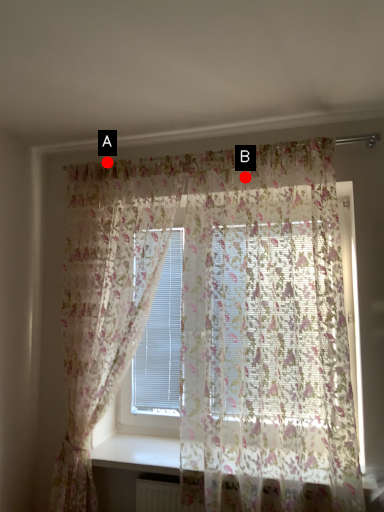
Question: Two points are circled on the image, labeled by A and B beside each circle. Which of the following is the closest to the observer?

Choices:
 (A) A is closer
 (B) B is closer

Answer: (B)